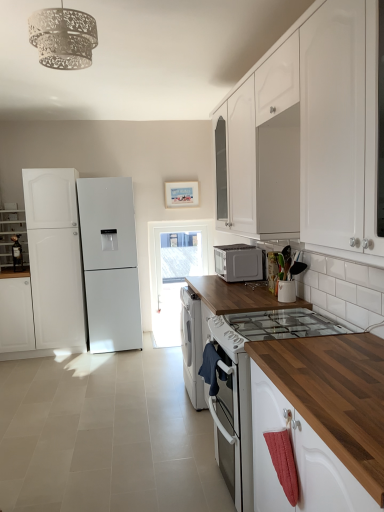
Question: Is point (21, 247) closer or farther from the camera than point (13, 311)?

Choices:
 (A) farther
 (B) closer

Answer: (A)

Question: Is matte white cabinet at left, the 1th cabinetry in the back-to-front sequence, taller or shorter than white matte cabinet at left, the fourth cabinetry from the right?

Choices:
 (A) short
 (B) tall

Answer: (A)

Question: Which of these objects is positioned closest to the white glossy cabinet at upper right, arranged as the 1th cabinetry when viewed from the right?

Choices:
 (A) wooden at center
 (B) matte white cabinet at left, acting as the third cabinetry starting from the right
 (C) transparent glass door at center
 (D) white matte cabinet at upper center, which ranks as the 3th cabinetry in left-to-right order
 (E) white matte cabinet at left, which is the 2th cabinetry in back-to-front order

Answer: (D)

Question: Which object is positioned farthest from the transparent glass door at center?

Choices:
 (A) white glossy cabinet at upper right, which ranks as the 4th cabinetry in left-to-right order
 (B) white matte cabinet at upper center, which ranks as the 3th cabinetry in left-to-right order
 (C) matte white cabinet at left, which is the 2th cabinetry from left to right
 (D) wooden at center
 (E) satin silver microwave at center

Answer: (A)